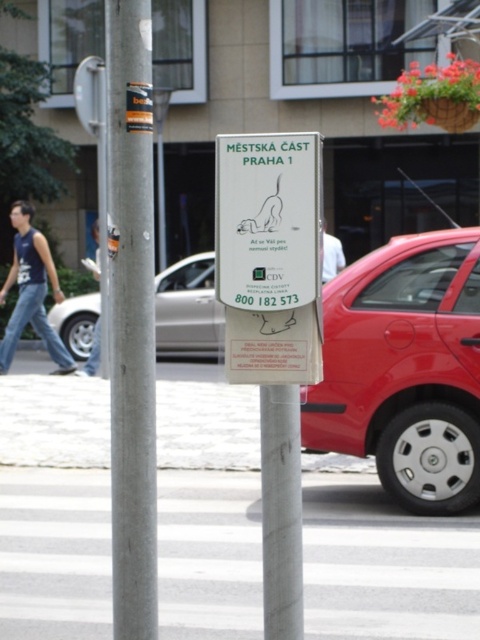
Question: Which of the following is the closest to the observer?

Choices:
 (A) white fabric shirt at upper center
 (B) blue denim jeans at lower left
 (C) silver metallic pole at left
 (D) white paper sign at center

Answer: (A)

Question: From the image, what is the correct spatial relationship of white paper sign at center in relation to silver metallic sedan at center?

Choices:
 (A) left
 (B) right

Answer: (B)

Question: Among these objects, which one is farthest from the camera?

Choices:
 (A) blue denim jeans at lower left
 (B) white fabric shirt at upper center

Answer: (A)

Question: Which object is farther from the camera taking this photo?

Choices:
 (A) blue denim jeans at lower left
 (B) metallic red car at right

Answer: (A)

Question: Is silver metallic pole at left thinner than white paper sign at center?

Choices:
 (A) yes
 (B) no

Answer: (A)

Question: Does silver metallic pole at left appear on the left side of blue denim jeans at lower left?

Choices:
 (A) no
 (B) yes

Answer: (A)